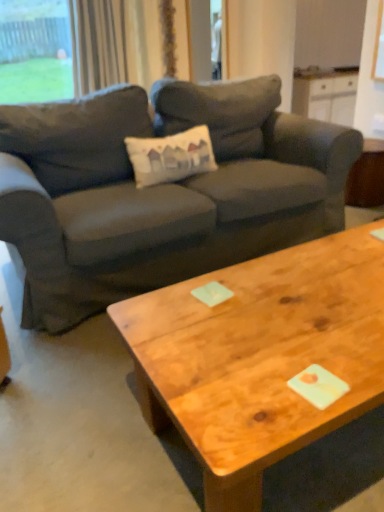
Question: Based on their sizes in the image, would you say dark gray fabric couch at center is bigger or smaller than light beige fabric curtain at upper left?

Choices:
 (A) small
 (B) big

Answer: (B)

Question: Is dark gray fabric couch at center taller or shorter than light beige fabric curtain at upper left?

Choices:
 (A) tall
 (B) short

Answer: (A)

Question: Based on their relative distances, which object is nearer to the dark gray fabric couch at center?

Choices:
 (A) wooden side table at right
 (B) wooden coffee table at center
 (C) green glass window at upper left
 (D) light beige fabric curtain at upper left

Answer: (B)

Question: Estimate the real-world distances between objects in this image. Which object is farther from the light beige fabric curtain at upper left?

Choices:
 (A) wooden side table at right
 (B) green glass window at upper left
 (C) wooden coffee table at center
 (D) dark gray fabric couch at center

Answer: (C)